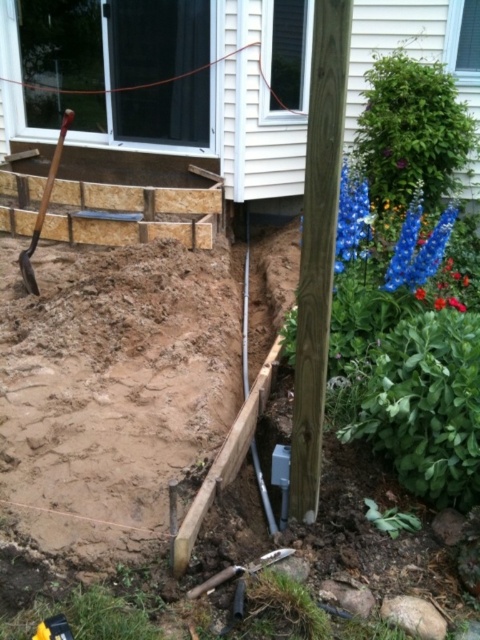
You are a construction worker who needs to place a safety cone between the brown wood pole at center and the wooden shovel at left. Based on their positions, where should the safety cone be placed?

The safety cone should be placed between the brown wood pole at center and the wooden shovel at left, closer to the wooden shovel at left since the brown wood pole at center is below it.

You are a construction worker standing at the edge of the trench in front of the house. You need to place a 5 feet long safety barrier between yourself and the brown wood pole at center. Is there enough space to place it?

The brown wood pole at center is 4.83 feet away from the viewer. Since the safety barrier is 5 feet long, it would require more space than available to place it between the worker and the pole.